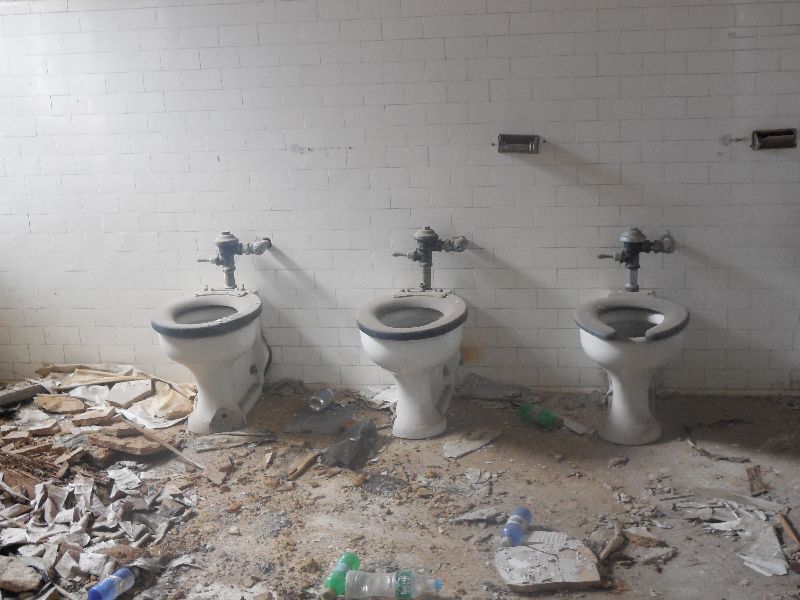
Locate an element on the screen. The width and height of the screenshot is (800, 600). toilet is located at coordinates (225, 370).